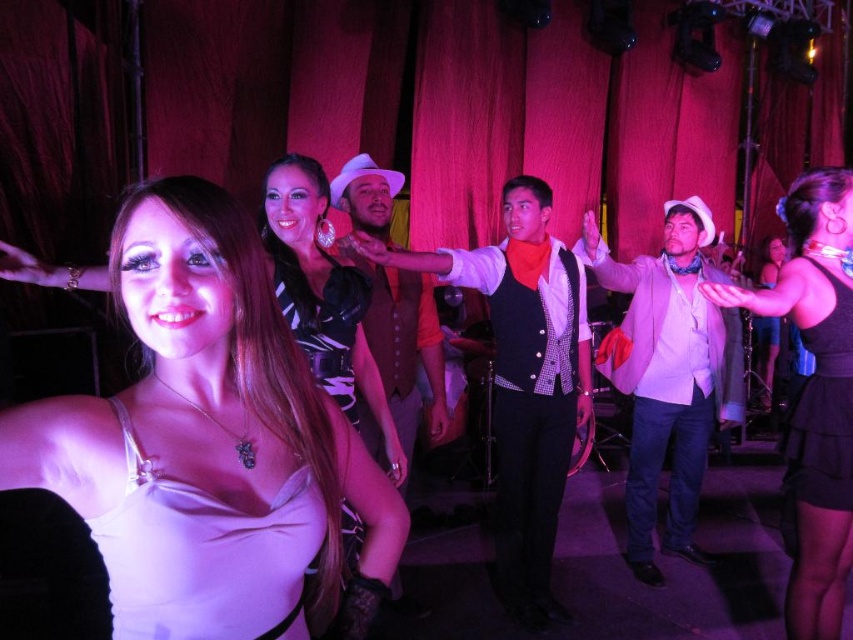
You are a photographer at the event and want to capture a group photo of the matte white dress at center and the satin black dress at center. The camera you are using has a minimum focus distance of 35 inches. Will you be able to focus on both subjects clearly?

The matte white dress at center is 34.43 inches away from the satin black dress at center. Since the distance between them is less than the camera minimum focus distance of 35 inches, the camera will not be able to focus on both subjects clearly at the same time.

In the scene shown: You are organizing a fashion show and need to arrange the white satin dress at lower left and the leather dress at center on a runway. Which dress requires more space for proper display?

The leather dress at center requires more space for proper display since it occupies more space than the white satin dress at lower left.